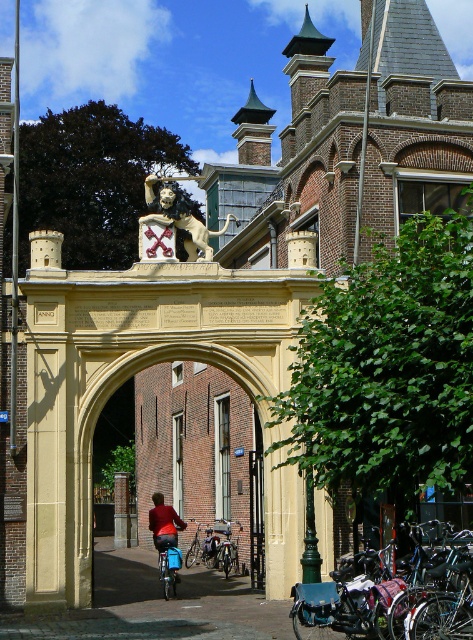
You are standing in front of the historic gateway archway and want to place a small decorative plaque between the two points, point (196,410) and point (125,528). Which point should the plaque be placed closer to in order to be more visible to visitors approaching from the front?

A: The plaque should be placed closer to point (196,410) because it is closer to the viewer than point (125,528), making it more visible to those approaching from the front.

You are a delivery person trying to enter a narrow alleyway. The entrance is marked by the beige stone archway at center. There is a shiny black bicycle at lower right parked near the entrance. Considering the height of the archway compared to the bicycle, do you think your 2.2 meters tall delivery van can pass under the archway?

The beige stone archway at center is much taller than the shiny black bicycle at lower right, so the delivery van that is 2.2 meters tall can pass under the archway since it is shorter than the archway.

In the scene shown: You are a delivery person carrying a large package that is 1.2 meters wide. You need to pass through the space between the red fabric jacket at center and the shiny metallic bicycle at center. Can your package fit through that space?

The red fabric jacket at center might be wider than the shiny metallic bicycle at center, so the space between them may be too narrow for the 1.2 meter wide package. It is uncertain and risky to attempt passing through without knowing the exact width difference.